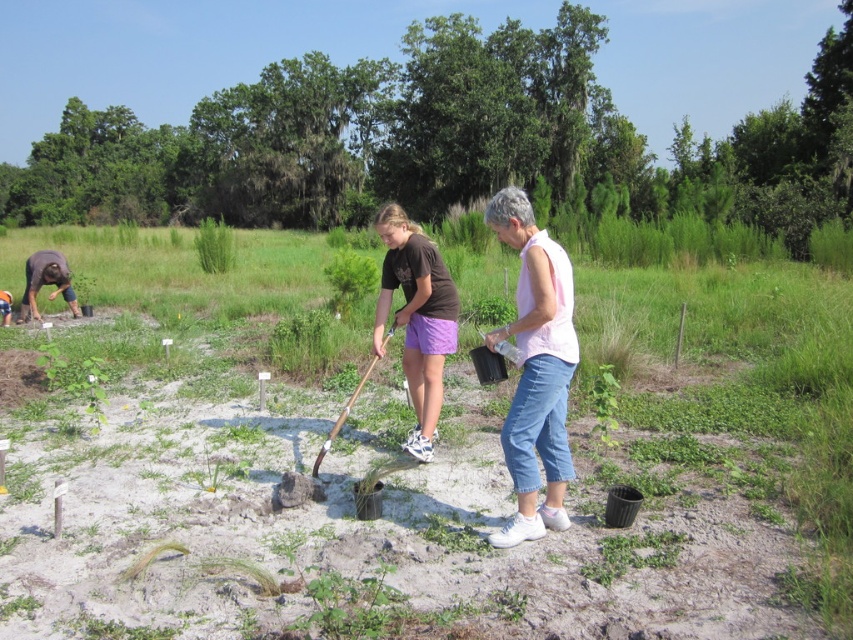
The height and width of the screenshot is (640, 853). What do you see at coordinates (416, 317) in the screenshot?
I see `matte brown shirt at center` at bounding box center [416, 317].

Is point (422, 241) in front of point (6, 301)?

Yes.

Find the location of a particular element. The image size is (853, 640). matte brown shirt at center is located at coordinates (416, 317).

Find the location of a particular element. The image size is (853, 640). matte brown shirt at center is located at coordinates (416, 317).

Describe the element at coordinates (416, 317) in the screenshot. This screenshot has height=640, width=853. I see `matte brown shirt at center` at that location.

Who is more forward, (386, 230) or (374, 356)?

Point (386, 230) is in front.

Where is `matte brown shirt at center`? This screenshot has width=853, height=640. matte brown shirt at center is located at coordinates (416, 317).

Who is more forward, (212, 248) or (314, 467)?

Positioned in front is point (314, 467).

Looking at this image, which of these two, green grass at center or wooden shovel at center, stands taller?

green grass at center is taller.

Who is more distant from viewer, (199, 252) or (366, 376)?

Point (199, 252)

Where is `green grass at center`? This screenshot has width=853, height=640. green grass at center is located at coordinates 215,244.